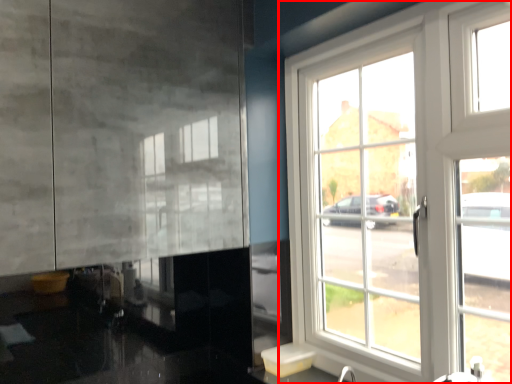
Question: Where is window (annotated by the red box) located in relation to sink in the image?

Choices:
 (A) left
 (B) right

Answer: (B)